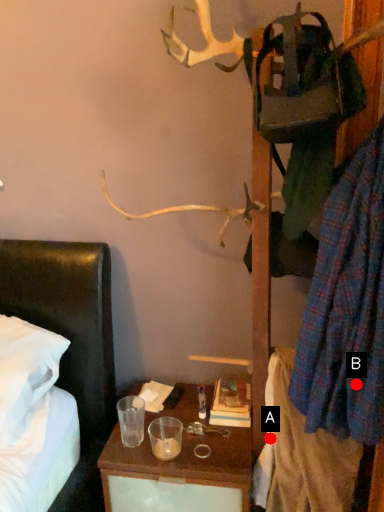
Question: Two points are circled on the image, labeled by A and B beside each circle. Which of the following is the farthest from the observer?

Choices:
 (A) A is further
 (B) B is further

Answer: (A)